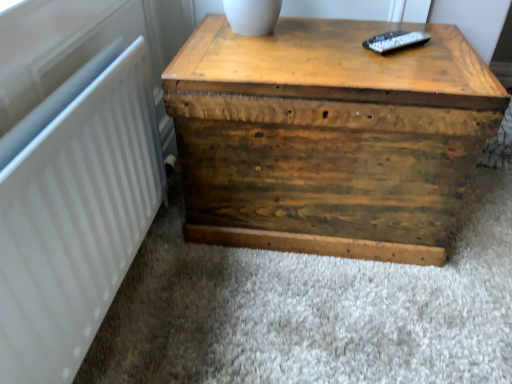
At what (x,y) coordinates should I click in order to perform the action: click on free space above wooden trunk at center (from a real-world perspective). Please return your answer as a coordinate pair (x, y). Looking at the image, I should click on pos(336,56).